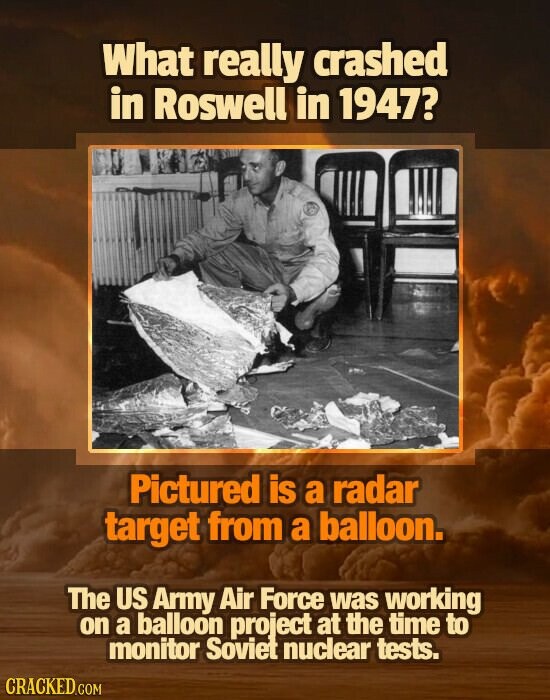
Image resolution: width=550 pixels, height=700 pixels. Find the location of `chair legs`. chair legs is located at coordinates pos(382,287), pos(371,284).